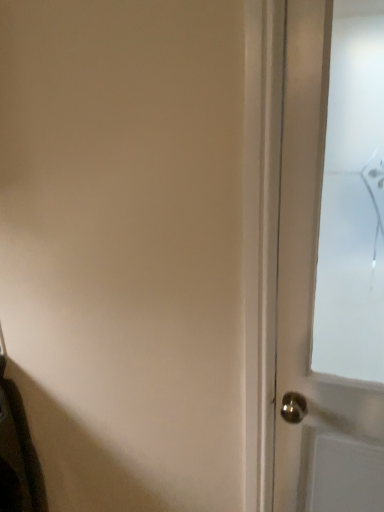
The width and height of the screenshot is (384, 512). I want to click on satin brass door handle at right, so click(331, 260).

The height and width of the screenshot is (512, 384). Describe the element at coordinates (331, 260) in the screenshot. I see `satin brass door handle at right` at that location.

Where is `satin brass door handle at right`? The height and width of the screenshot is (512, 384). satin brass door handle at right is located at coordinates pyautogui.click(x=331, y=260).